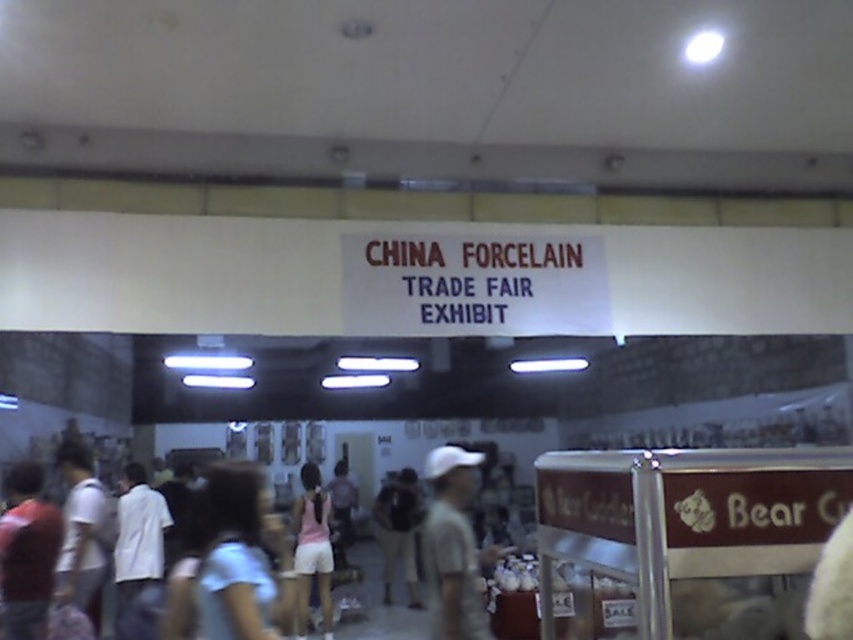
You are standing at the entrance of the China Porcelain Trade Fair Exhibit and see a point marked at coordinates (241, 557). Based on the scene description, what color fabric is this point located on?

The point at (241, 557) is located on light blue fabric at center.

Based on the photo, you are a photographer at the China Porcelain Trade Fair Exhibit. You want to capture a clear photo of the light blue fabric at center and the gray matte shirt at center. Which object should you focus on to ensure the widest part is in sharp detail?

The light blue fabric at center might be wider than gray matte shirt at center, so you should focus on the light blue fabric at center to ensure the widest part is in sharp detail.